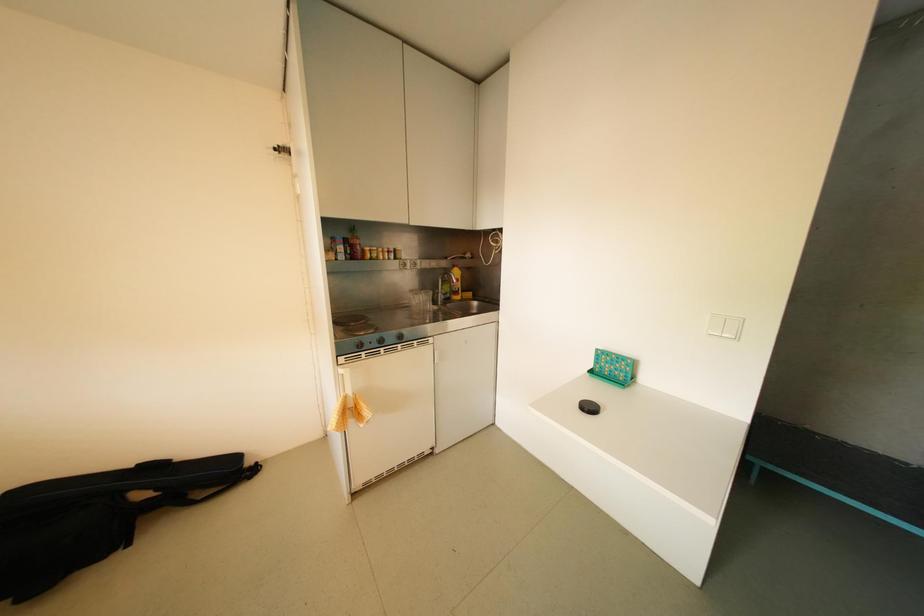
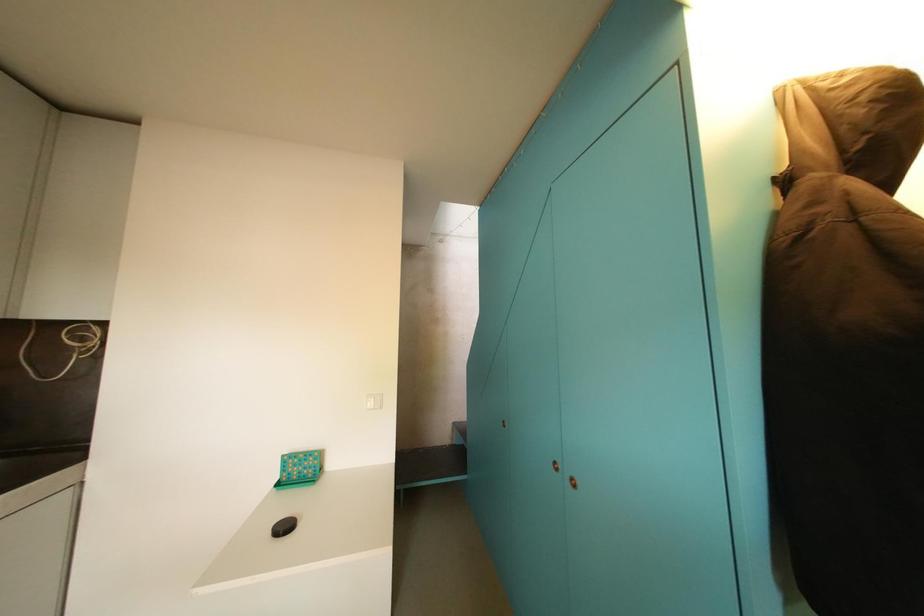
Question: Based on the continuous images, in which direction is the camera rotating? Reply with the corresponding letter.

Choices:
 (A) Left
 (B) Right
 (C) Up
 (D) Down

Answer: (B)